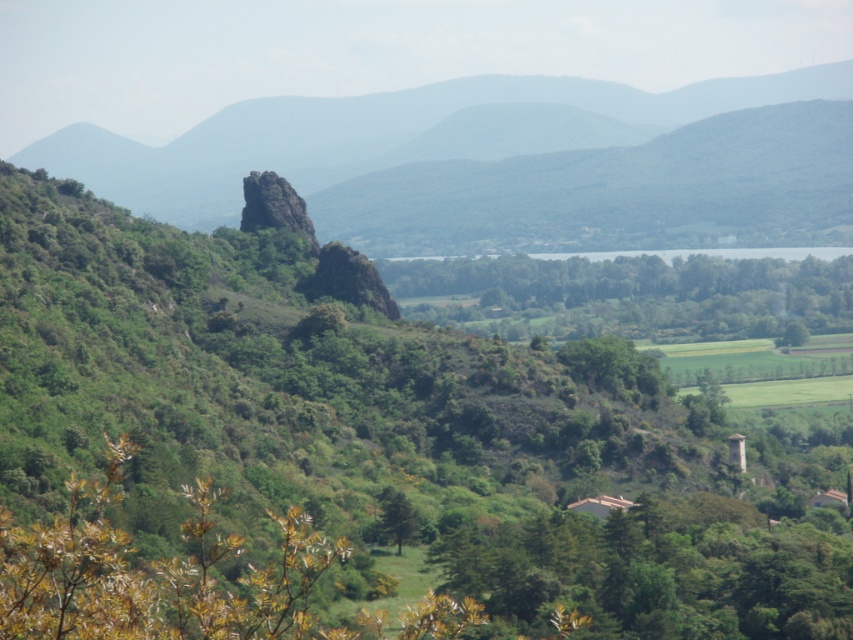
Question: Is rough stone rock at center further to camera compared to green matte tree at center?

Choices:
 (A) no
 (B) yes

Answer: (B)

Question: Which point is farther to the camera?

Choices:
 (A) (415, 528)
 (B) (51, 147)
 (C) (691, 266)

Answer: (B)

Question: Does rugged stone mountain at center appear on the left side of green leafy tree at lower right?

Choices:
 (A) no
 (B) yes

Answer: (B)

Question: Is the position of green leafy tree at center more distant than that of green leafy trees at center?

Choices:
 (A) yes
 (B) no

Answer: (B)

Question: Which object is the farthest from the rough stone rock at center?

Choices:
 (A) green leafy tree at center
 (B) green matte tree at center

Answer: (B)

Question: Considering the real-world distances, which object is farthest from the green matte tree at center?

Choices:
 (A) rugged stone mountain at center
 (B) green leafy tree at lower right
 (C) green leafy tree at center

Answer: (A)